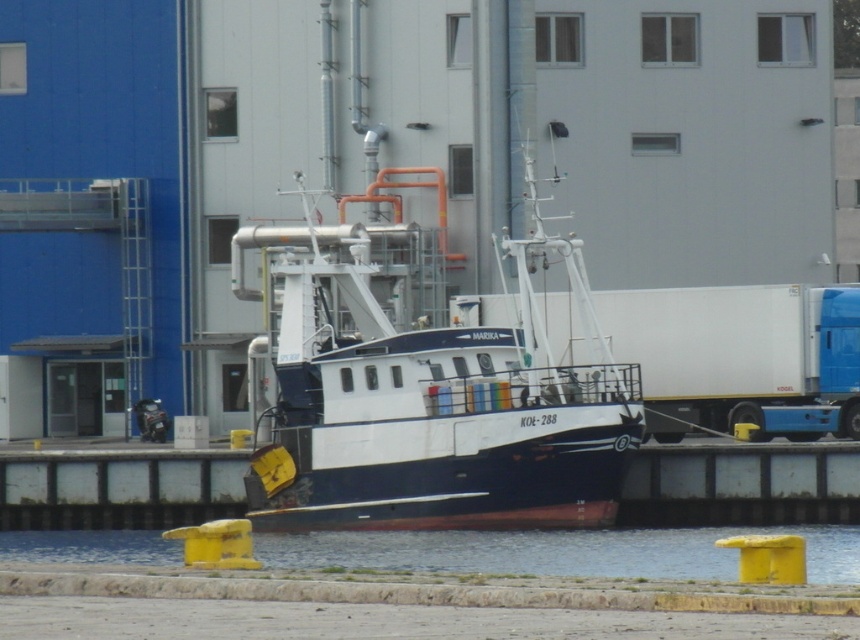
Question: Is white matte boat at center positioned before white matte truck at center?

Choices:
 (A) yes
 (B) no

Answer: (A)

Question: Can you confirm if white matte boat at center is thinner than white matte truck at center?

Choices:
 (A) no
 (B) yes

Answer: (A)

Question: Which point is farther from the camera taking this photo?

Choices:
 (A) (357, 438)
 (B) (172, 557)
 (C) (609, 336)

Answer: (C)

Question: Does white matte truck at center appear over transparent water at lower center?

Choices:
 (A) no
 (B) yes

Answer: (B)

Question: Which of the following is the closest to the observer?

Choices:
 (A) (373, 536)
 (B) (783, 289)

Answer: (A)

Question: Which of the following is the closest to the observer?

Choices:
 (A) white matte truck at center
 (B) white matte boat at center

Answer: (B)